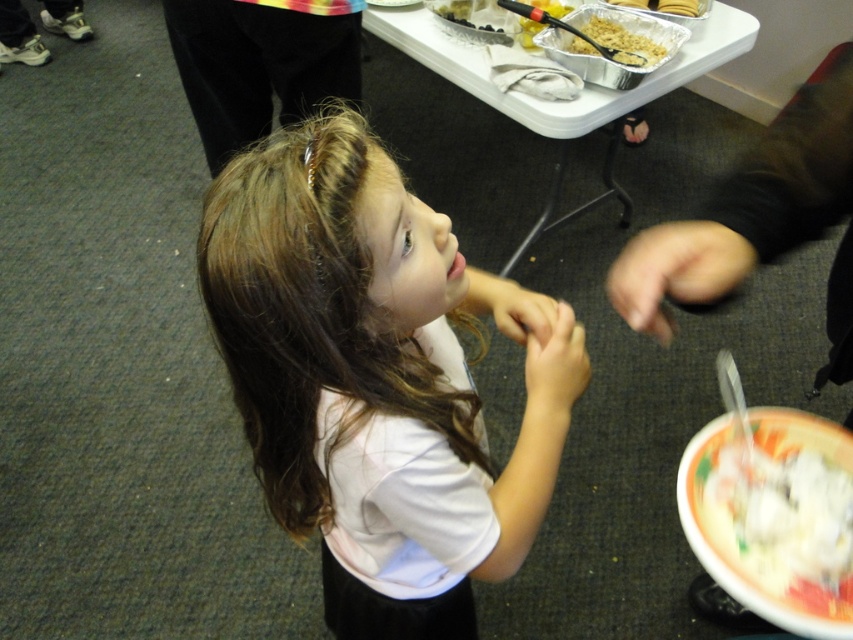
Question: Does white plastic tray at upper center appear on the left side of shiny plastic spoon at upper center?

Choices:
 (A) no
 (B) yes

Answer: (A)

Question: Among these objects, which one is nearest to the camera?

Choices:
 (A) white creamy bowl at lower right
 (B) shiny plastic spoon at upper center
 (C) white matte shirt at center
 (D) white plastic tray at upper center

Answer: (C)

Question: Does white matte shirt at center have a larger size compared to white plastic tray at upper center?

Choices:
 (A) no
 (B) yes

Answer: (B)

Question: From the image, what is the correct spatial relationship of white matte shirt at center in relation to white creamy bowl at lower right?

Choices:
 (A) above
 (B) below

Answer: (B)

Question: Estimate the real-world distances between objects in this image. Which object is closer to the white creamy bowl at lower right?

Choices:
 (A) shiny plastic spoon at upper center
 (B) metallic aluminum foil tray at upper center
 (C) white plastic tray at upper center
 (D) white matte shirt at center

Answer: (D)

Question: Which object is the closest to the metallic aluminum foil tray at upper center?

Choices:
 (A) white creamy bowl at lower right
 (B) white plastic tray at upper center
 (C) shiny plastic spoon at upper center
 (D) white matte shirt at center

Answer: (C)